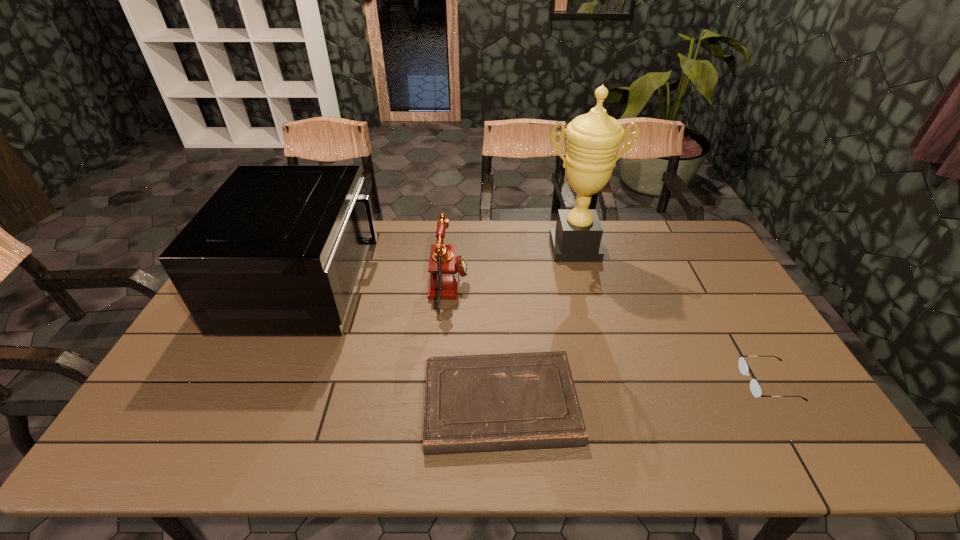
Find the location of a particular element. The width and height of the screenshot is (960, 540). the tallest object is located at coordinates (593, 140).

In order to click on the second tallest object in this screenshot , I will do `click(278, 249)`.

The height and width of the screenshot is (540, 960). Find the location of `microwave_oven`. microwave_oven is located at coordinates (278, 249).

At what (x,y) coordinates should I click in order to perform the action: click on the third tallest object. Please return your answer as a coordinate pair (x, y). This screenshot has width=960, height=540. Looking at the image, I should click on (444, 267).

Where is `the rightmost object`? the rightmost object is located at coordinates (755, 388).

Find the location of a particular element. This screenshot has height=540, width=960. paperback book is located at coordinates (515, 401).

Locate an element on the screen. The height and width of the screenshot is (540, 960). vacant space located 0.390m at the front of the trophy cup with handles is located at coordinates (603, 353).

You are a GUI agent. You are given a task and a screenshot of the screen. Output one action in this format:
    pyautogui.click(x=<x>, y=<y>)
    Task: Click on the vacant space located 0.380m on the front-facing side of the leftmost object
    The height and width of the screenshot is (540, 960).
    Given the screenshot: What is the action you would take?
    pyautogui.click(x=491, y=284)

Image resolution: width=960 pixels, height=540 pixels. Identify the location of vacant space located on the dial of the third shortest object. click(577, 288).

Identify the location of free spot located 0.340m on the lenses of the spectacles. (614, 382).